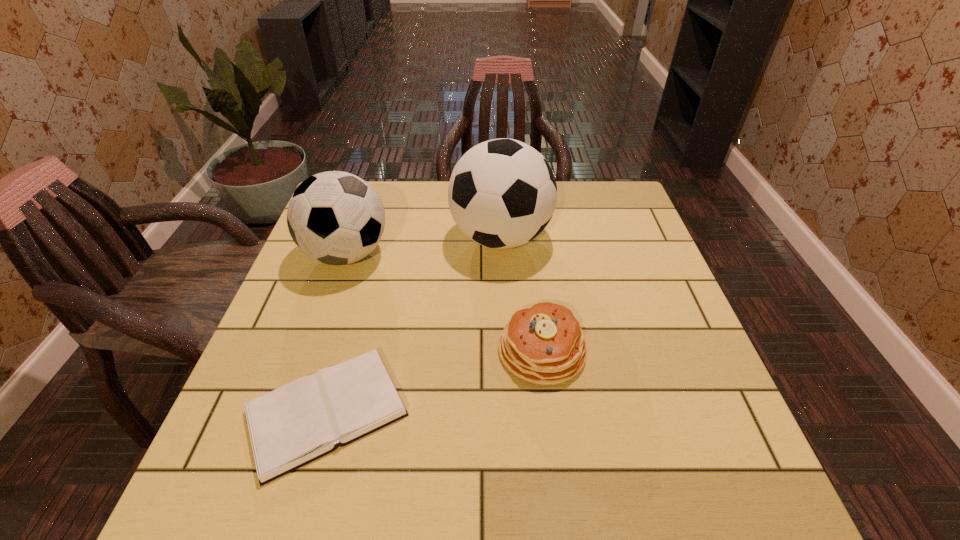
Where is `vacant area that lies between the shorter soccer ball and the pancake`? vacant area that lies between the shorter soccer ball and the pancake is located at coordinates (444, 302).

Find the location of a particular element. vacant area that lies between the second shortest object and the taller soccer ball is located at coordinates (521, 294).

Where is `vacant region between the left soccer ball and the tallest object`? The width and height of the screenshot is (960, 540). vacant region between the left soccer ball and the tallest object is located at coordinates click(x=423, y=246).

What are the coordinates of `unoccupied position between the second tallest object and the right soccer ball` in the screenshot? It's located at (423, 246).

This screenshot has width=960, height=540. I want to click on free area in between the shortest object and the right soccer ball, so click(x=414, y=325).

This screenshot has height=540, width=960. Find the location of `vacant space in between the second shortest object and the second tallest object`. vacant space in between the second shortest object and the second tallest object is located at coordinates (444, 302).

In order to click on free space that is in between the shorter soccer ball and the tallest object in this screenshot , I will do `click(423, 246)`.

Image resolution: width=960 pixels, height=540 pixels. I want to click on vacant space that's between the taller soccer ball and the second tallest object, so click(423, 246).

Locate an element on the screen. The height and width of the screenshot is (540, 960). free space between the hardback book and the pancake is located at coordinates (434, 381).

Where is `vacant area that lies between the shortest object and the right soccer ball`? This screenshot has height=540, width=960. vacant area that lies between the shortest object and the right soccer ball is located at coordinates (414, 325).